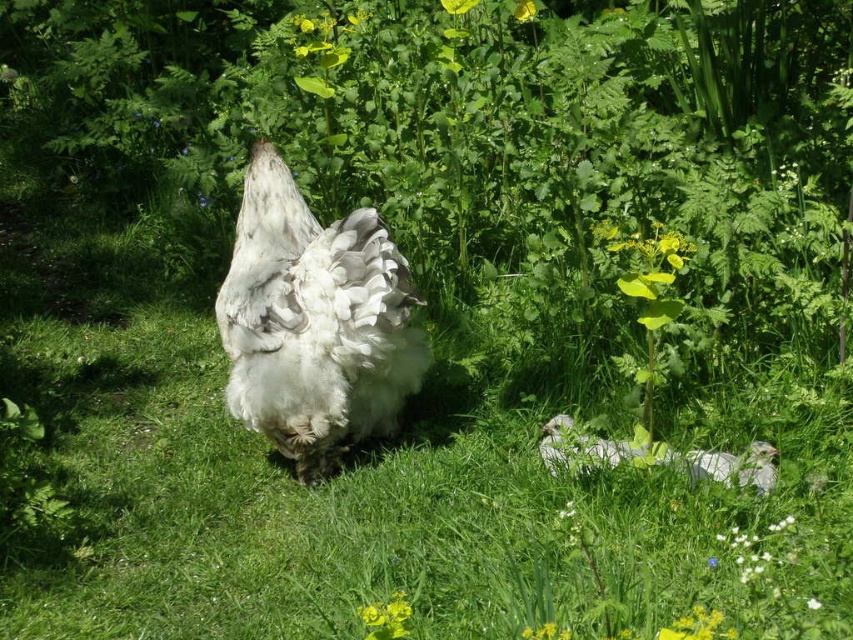
You are a photographer trying to capture the white fluffy chicken at center in the image. Based on its position, which direction should you move your camera to center it perfectly?

The white fluffy chicken at center is already positioned at the center of the frame at coordinates point (314, 323), so no adjustment is needed. It is already centered.

You are a photographer trying to capture both the white fluffy chicken at center and the white fluffy chicken at lower center in a single shot. Which chicken should you focus on first if you want to ensure both are in the frame?

The white fluffy chicken at center is taller than the white fluffy chicken at lower center, so focusing on the taller chicken first will help ensure both are in the frame.

You are a photographer trying to capture the white fluffy chicken at center and the white fluffy chicken at lower center in a single shot. Which chicken is positioned farther away from the camera?

The white fluffy chicken at lower center is positioned farther away from the camera than the white fluffy chicken at center because it is described as being behind the first chicken.